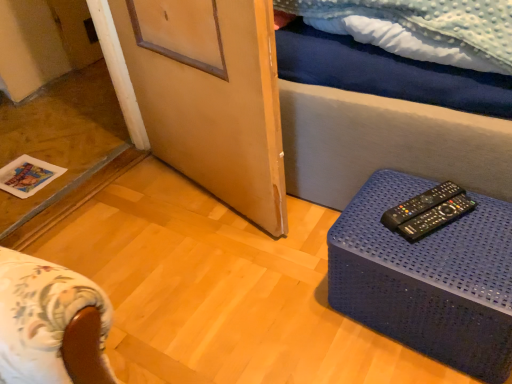
Question: From the image's perspective, is black plastic remote control at right, positioned as the 1th remote control in back-to-front order, located above black plastic remote controls at right, which ranks as the 1th remote control in front-to-back order?

Choices:
 (A) yes
 (B) no

Answer: (A)

Question: Is black plastic remote control at right, the 2th remote control when ordered from front to back, looking in the opposite direction of black plastic remote controls at right, which ranks as the 1th remote control in front-to-back order?

Choices:
 (A) yes
 (B) no

Answer: (B)

Question: From a real-world perspective, is black plastic remote control at right, positioned as the 1th remote control in back-to-front order, beneath black plastic remote controls at right, which ranks as the 1th remote control in front-to-back order?

Choices:
 (A) yes
 (B) no

Answer: (B)

Question: Is black plastic remote control at right, positioned as the 1th remote control in back-to-front order, not inside black plastic remote controls at right, arranged as the 2th remote control when viewed from the back?

Choices:
 (A) yes
 (B) no

Answer: (A)

Question: Considering the relative sizes of black plastic remote control at right, positioned as the 1th remote control in back-to-front order, and black plastic remote controls at right, arranged as the 2th remote control when viewed from the back, in the image provided, is black plastic remote control at right, positioned as the 1th remote control in back-to-front order, shorter than black plastic remote controls at right, arranged as the 2th remote control when viewed from the back,?

Choices:
 (A) yes
 (B) no

Answer: (A)

Question: From the image's perspective, is blue plastic table at lower right above or below wooden screen door at center?

Choices:
 (A) below
 (B) above

Answer: (A)

Question: In terms of height, does blue plastic table at lower right look taller or shorter compared to wooden screen door at center?

Choices:
 (A) tall
 (B) short

Answer: (B)

Question: Looking at their shapes, would you say blue plastic table at lower right is wider or thinner than wooden screen door at center?

Choices:
 (A) wide
 (B) thin

Answer: (A)

Question: Which is correct: blue plastic table at lower right is inside wooden screen door at center, or outside of it?

Choices:
 (A) inside
 (B) outside

Answer: (B)

Question: Is black plastic remote control at right, the 2th remote control when ordered from front to back, bigger or smaller than blue plastic table at lower right?

Choices:
 (A) big
 (B) small

Answer: (B)

Question: Relative to blue plastic table at lower right, is black plastic remote control at right, the 2th remote control when ordered from front to back, in front or behind?

Choices:
 (A) behind
 (B) front

Answer: (A)

Question: From a real-world perspective, is black plastic remote control at right, positioned as the 1th remote control in back-to-front order, physically located above or below blue plastic table at lower right?

Choices:
 (A) above
 (B) below

Answer: (A)

Question: Considering the relative positions of black plastic remote control at right, the 2th remote control when ordered from front to back, and blue plastic table at lower right in the image provided, is black plastic remote control at right, the 2th remote control when ordered from front to back, to the left or to the right of blue plastic table at lower right?

Choices:
 (A) left
 (B) right

Answer: (A)

Question: From the image's perspective, is blue plastic table at lower right above or below black plastic remote control at right, positioned as the 1th remote control in back-to-front order?

Choices:
 (A) below
 (B) above

Answer: (A)

Question: From a real-world perspective, relative to black plastic remote control at right, the 2th remote control when ordered from front to back, is blue plastic table at lower right vertically above or below?

Choices:
 (A) above
 (B) below

Answer: (B)